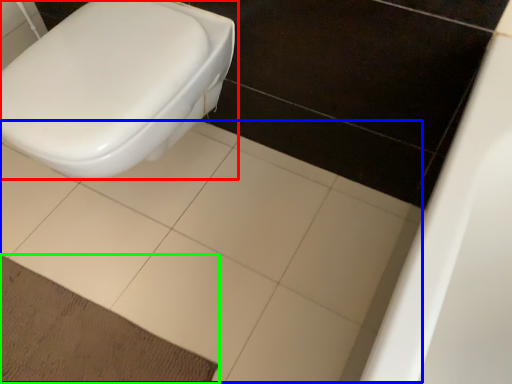
Question: Considering the real-world distances, which object is farthest from toilet (highlighted by a red box)? ceramic tile (highlighted by a blue box) or doormat (highlighted by a green box)?

Choices:
 (A) ceramic tile
 (B) doormat

Answer: (B)